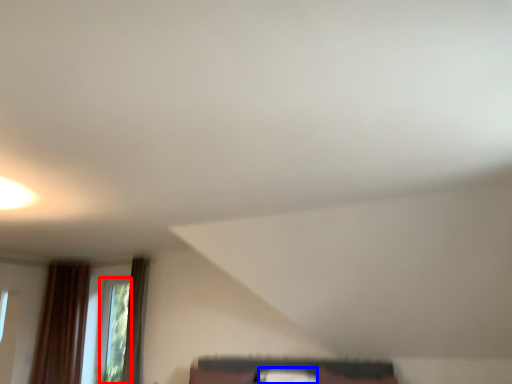
Question: Among these objects, which one is farthest to the camera, window (highlighted by a red box) or pillow (highlighted by a blue box)?

Choices:
 (A) window
 (B) pillow

Answer: (A)